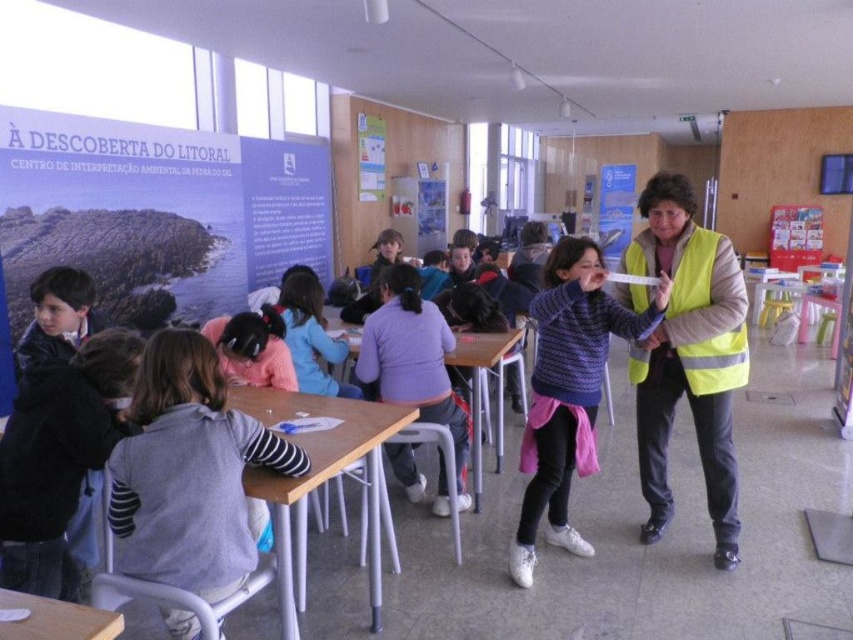
From the picture: Is gray sweater at left above yellow reflective vest at center?

Incorrect, gray sweater at left is not positioned above yellow reflective vest at center.

Is gray sweater at left positioned in front of yellow reflective vest at center?

Yes.

Locate an element on the screen. This screenshot has height=640, width=853. gray sweater at left is located at coordinates (190, 472).

Between white plastic table at center and wooden table at lower left, which one is positioned higher?

white plastic table at center

Can you confirm if white plastic table at center is positioned above wooden table at lower left?

Yes, white plastic table at center is above wooden table at lower left.

Is point (312, 433) less distant than point (86, 632)?

No, (312, 433) is behind (86, 632).

You are a GUI agent. You are given a task and a screenshot of the screen. Output one action in this format:
    pyautogui.click(x=<x>, y=<y>)
    Task: Click on the white plastic table at center
    
    Given the screenshot: What is the action you would take?
    pyautogui.click(x=318, y=481)

Does point (207, 544) come behind point (544, 344)?

No, it is not.

Can you confirm if gray sweater at left is bigger than knitted sweater at center?

Actually, gray sweater at left might be smaller than knitted sweater at center.

Consider the image. Who is more forward, (131, 522) or (554, 529)?

Point (131, 522) is in front.

You are a GUI agent. You are given a task and a screenshot of the screen. Output one action in this format:
    pyautogui.click(x=<x>, y=<y>)
    Task: Click on the gray sweater at left
    The width and height of the screenshot is (853, 640).
    Given the screenshot: What is the action you would take?
    pyautogui.click(x=190, y=472)